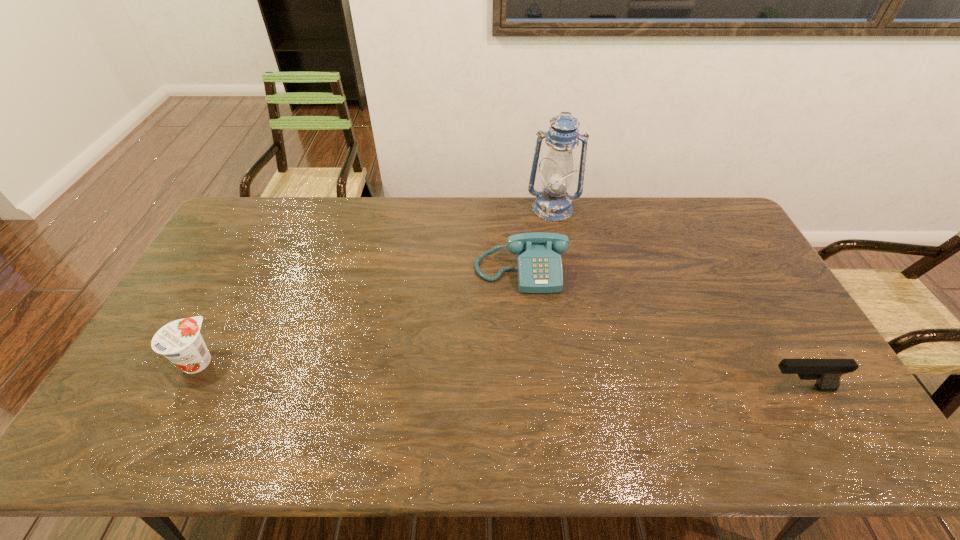
Where is `vacant region located 0.050m on the front-facing side of the rightmost object`? The width and height of the screenshot is (960, 540). vacant region located 0.050m on the front-facing side of the rightmost object is located at coordinates (742, 388).

At what (x,y) coordinates should I click in order to perform the action: click on free space located 0.120m on the dial of the second farthest object. Please return your answer as a coordinate pair (x, y). This screenshot has height=540, width=960. Looking at the image, I should click on (527, 325).

What are the coordinates of `vacant space located on the dial of the second farthest object` in the screenshot? It's located at (527, 325).

Locate an element on the screen. free region located 0.300m on the dial of the second farthest object is located at coordinates (534, 380).

Locate an element on the screen. free space located 0.400m on the front-facing side of the lantern is located at coordinates (549, 305).

Identify the location of free space located on the front-facing side of the lantern. (549, 305).

At what (x,y) coordinates should I click in order to perform the action: click on free space located 0.090m on the front-facing side of the lantern. Please return your answer as a coordinate pair (x, y). Looking at the image, I should click on (551, 238).

Where is `object situated at the far edge`? object situated at the far edge is located at coordinates (553, 203).

Image resolution: width=960 pixels, height=540 pixels. What are the coordinates of `yogurt at the near edge` in the screenshot? It's located at (180, 341).

At what (x,y) coordinates should I click in order to perform the action: click on pistol that is at the near edge. Please return your answer as a coordinate pair (x, y). Looking at the image, I should click on (827, 372).